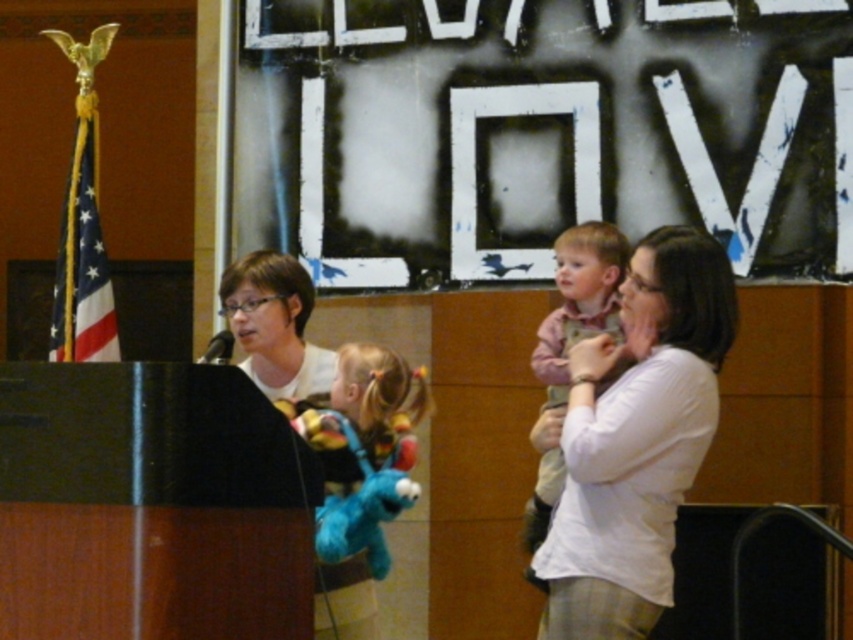
Question: Is white cotton shirt at center thinner than matte white shirt at center?

Choices:
 (A) no
 (B) yes

Answer: (A)

Question: Based on their relative distances, which object is nearer to the matte white shirt at center?

Choices:
 (A) white cotton shirt at center
 (B) pink cotton shirt at center

Answer: (B)

Question: Which object is farther from the camera taking this photo?

Choices:
 (A) matte white shirt at center
 (B) white cotton shirt at center
 (C) pink cotton shirt at center

Answer: (A)

Question: Does pink cotton shirt at center lie behind matte white shirt at center?

Choices:
 (A) yes
 (B) no

Answer: (B)

Question: Considering the real-world distances, which object is farthest from the pink cotton shirt at center?

Choices:
 (A) white cotton shirt at center
 (B) matte white shirt at center

Answer: (B)

Question: Does white cotton shirt at center have a smaller size compared to pink cotton shirt at center?

Choices:
 (A) no
 (B) yes

Answer: (A)